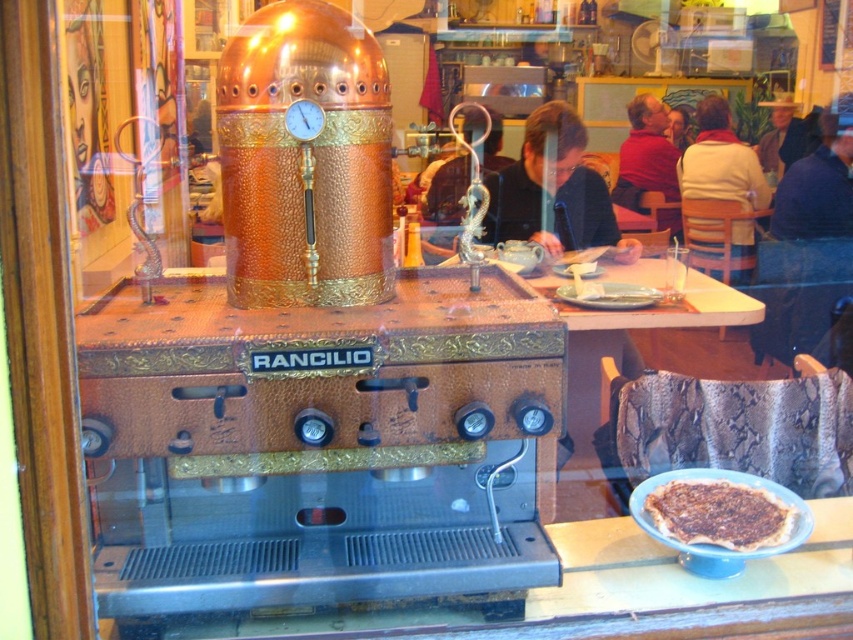
You are a customer entering the cafe and see the light brown wooden chair at upper right and the silver metallic dragon at center. Which object is positioned higher in the image?

The light brown wooden chair at upper right is positioned higher than the silver metallic dragon at center.

You are a delivery person who needs to place a matte black shirt at center into a box that is 1 foot in height. Can you determine if the shirt will fit vertically into the box?

The matte black shirt at center is 11.89 feet tall, which is significantly taller than the 1 foot height of the box. Therefore, the shirt cannot fit vertically into the box.